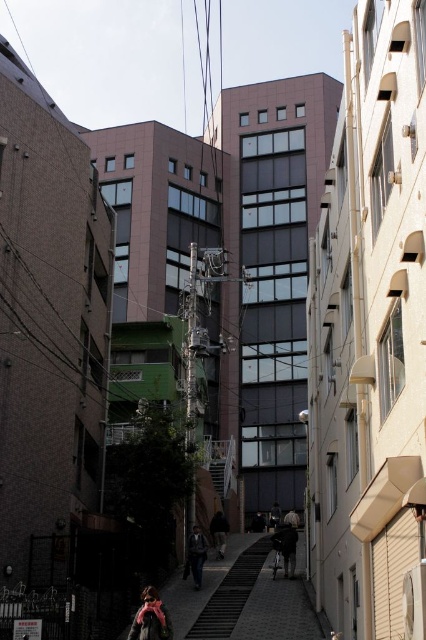
Looking at this image, is dark gray leather jacket at center to the left of dark gray fabric jacket at center from the viewer's perspective?

Yes, dark gray leather jacket at center is to the left of dark gray fabric jacket at center.

Is dark gray leather jacket at center below dark gray fabric jacket at center?

Actually, dark gray leather jacket at center is above dark gray fabric jacket at center.

Identify the location of dark gray leather jacket at center. (195, 556).

Which is in front, point (247, 556) or point (215, 547)?

Point (247, 556)

Which is more to the left, concrete stairs at center or dark gray fabric jacket at center?

dark gray fabric jacket at center is more to the left.

This screenshot has width=426, height=640. What do you see at coordinates (230, 593) in the screenshot? I see `concrete stairs at center` at bounding box center [230, 593].

You are a GUI agent. You are given a task and a screenshot of the screen. Output one action in this format:
    pyautogui.click(x=<x>, y=<y>)
    Task: Click on the concrete stairs at center
    The height and width of the screenshot is (640, 426).
    Given the screenshot: What is the action you would take?
    pyautogui.click(x=230, y=593)

Does matte pink scarf at lower center have a larger size compared to dark gray leather jacket at center?

Indeed, matte pink scarf at lower center has a larger size compared to dark gray leather jacket at center.

The width and height of the screenshot is (426, 640). Find the location of `matte pink scarf at lower center`. matte pink scarf at lower center is located at coordinates (150, 618).

I want to click on matte pink scarf at lower center, so click(x=150, y=618).